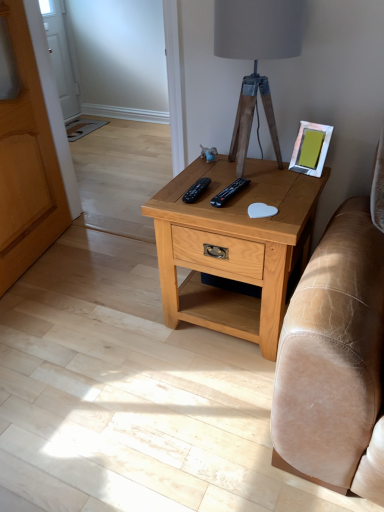
Where is `vacant location behind black plastic remote at center, the 2th remote positioned from the right`? Image resolution: width=384 pixels, height=512 pixels. vacant location behind black plastic remote at center, the 2th remote positioned from the right is located at coordinates (206, 174).